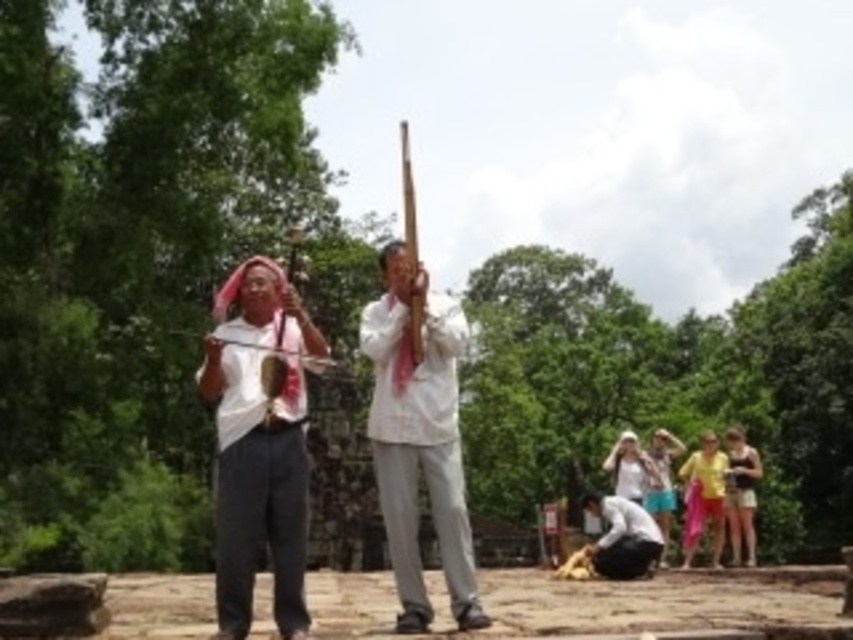
Is white matte shirt at center positioned before white matte/soft cloth at center?

Yes, it is in front of white matte/soft cloth at center.

Can you confirm if white matte shirt at center is positioned below white matte/soft cloth at center?

Yes.

Where is `white matte shirt at center`? The height and width of the screenshot is (640, 853). white matte shirt at center is located at coordinates (259, 445).